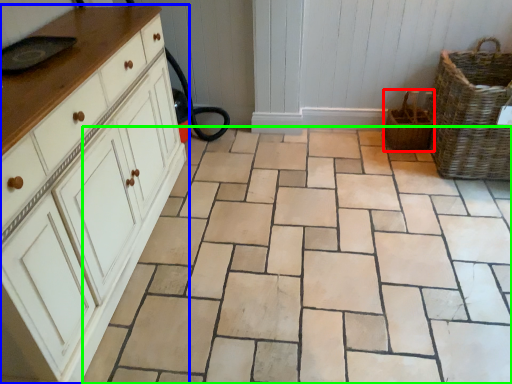
Question: Which object is the farthest from basket (highlighted by a red box)? Choose among these: chest of drawers (highlighted by a blue box) or ceramic tile (highlighted by a green box).

Choices:
 (A) chest of drawers
 (B) ceramic tile

Answer: (A)